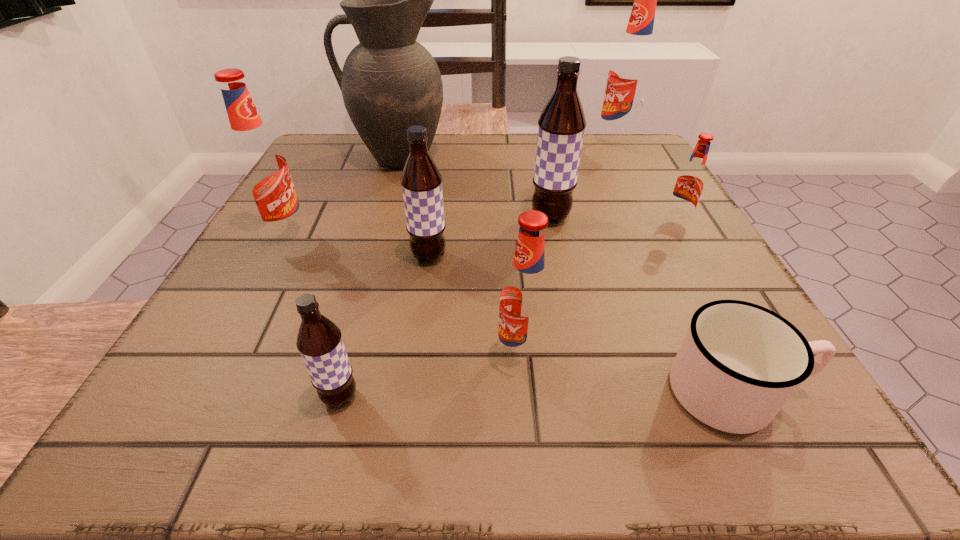
Where is `free space that satisfies the following two spatial constraints: 1. on the side of the smallest red root beer with the handle; 2. on the right side of the pitcher`? This screenshot has width=960, height=540. free space that satisfies the following two spatial constraints: 1. on the side of the smallest red root beer with the handle; 2. on the right side of the pitcher is located at coordinates (379, 221).